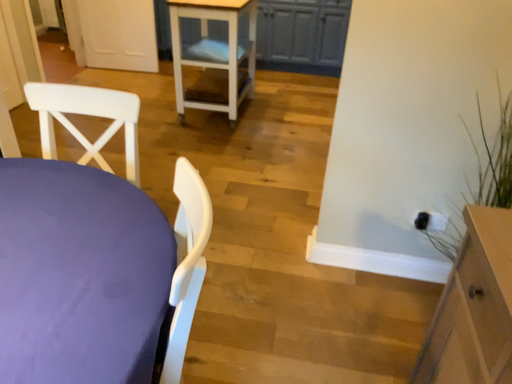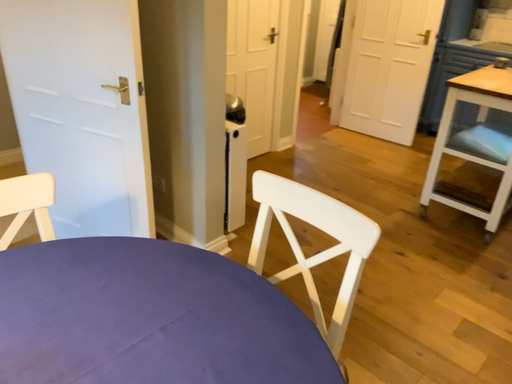
Question: How did the camera likely rotate when shooting the video?

Choices:
 (A) rotated upward
 (B) rotated downward

Answer: (A)